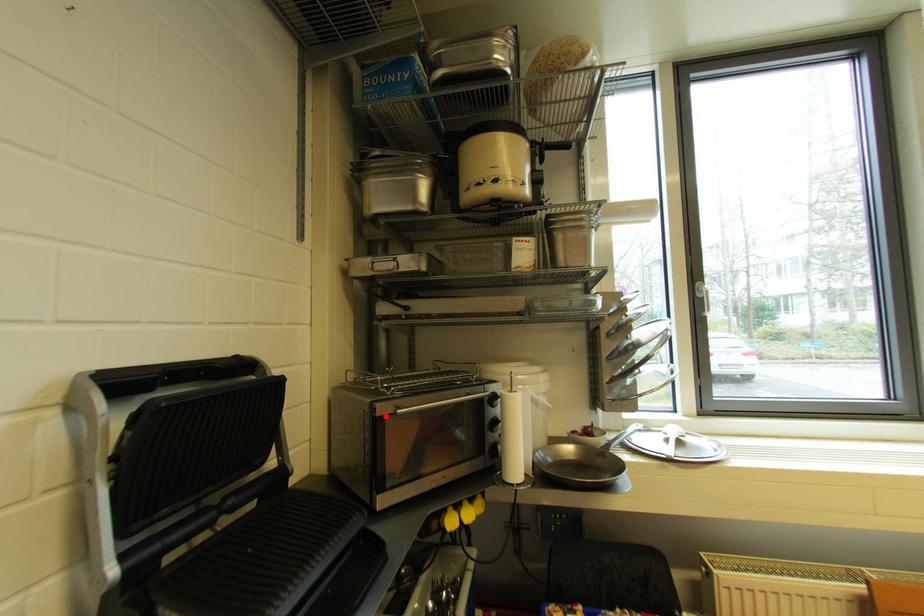
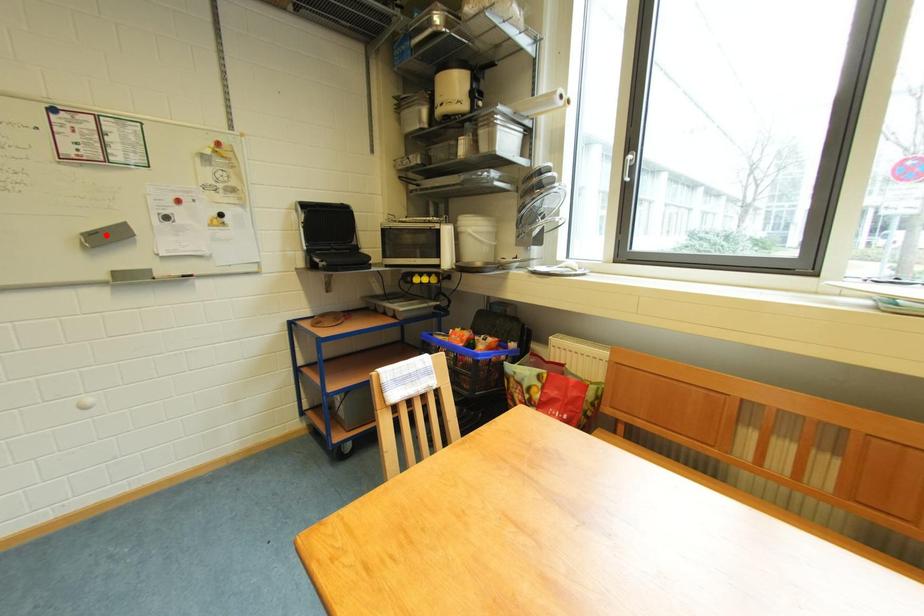
I am providing you with two images of the same scene from different viewpoints. A red point is marked on the first image and another point is marked on the second image. Is the red point in image1 aligned with the point shown in image2?

No